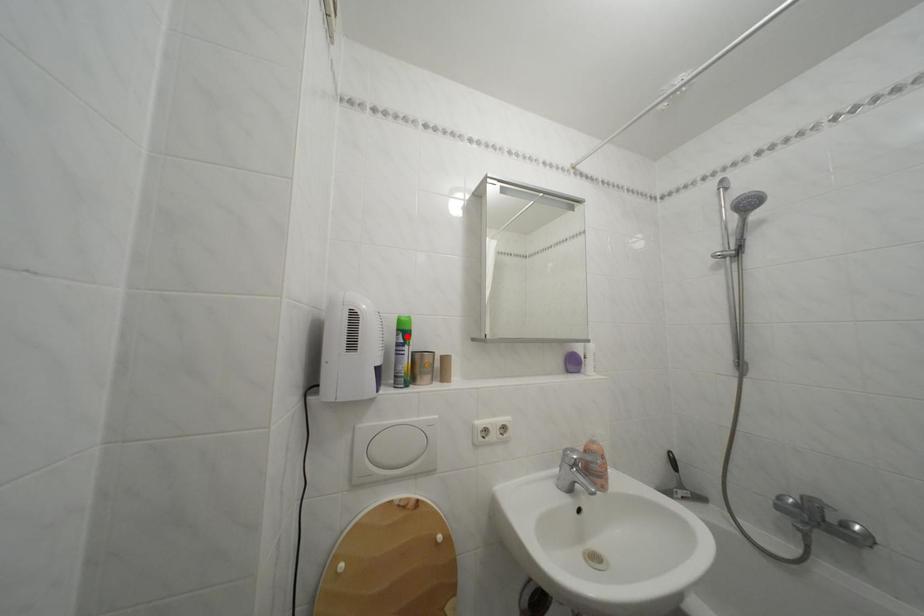
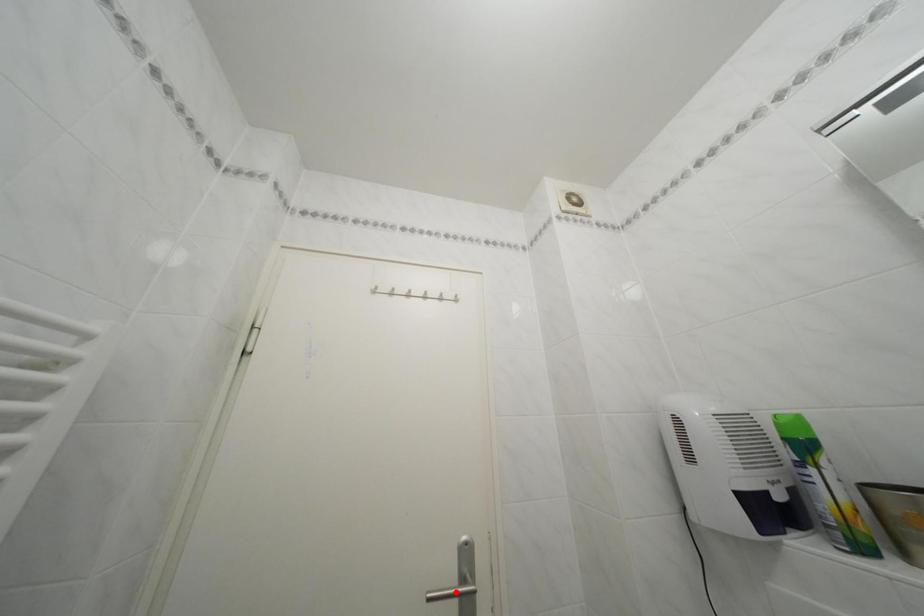
I am providing you with two images of the same scene from different viewpoints. A red point is marked on the first image and another point is marked on the second image. Are the points marked in image1 and image2 representing the same 3D position?

No